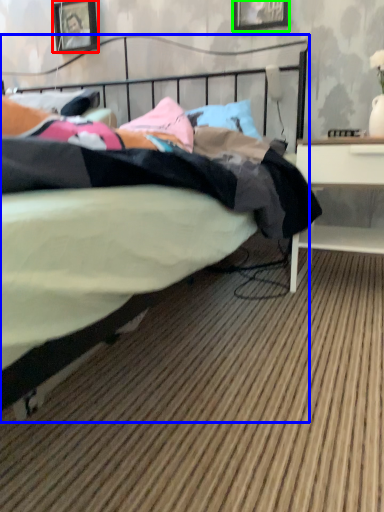
Question: Which is farther away from picture frame (highlighted by a red box)? bed (highlighted by a blue box) or picture frame (highlighted by a green box)?

Choices:
 (A) bed
 (B) picture frame

Answer: (A)